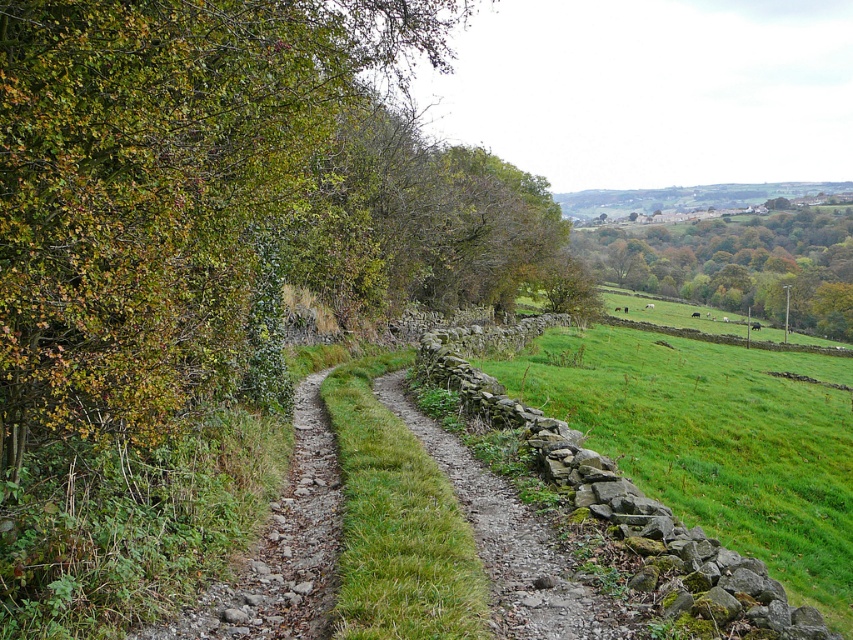
Is green grassy field at right in front of dull gray gravel path at left?

No.

How distant is green grassy field at right from dull gray gravel path at left?

They are 77.24 feet apart.

Does point (848, 502) come in front of point (268, 566)?

No, (848, 502) is behind (268, 566).

Find the location of a particular element. Image resolution: width=853 pixels, height=640 pixels. green grassy field at right is located at coordinates (714, 440).

Which is above, green leafy tree at upper left or green leafy tree at upper right?

green leafy tree at upper right is above.

Identify the location of green leafy tree at upper left. This screenshot has width=853, height=640. (418, 221).

This screenshot has width=853, height=640. What are the coordinates of `green leafy tree at upper left` in the screenshot? It's located at (418, 221).

From the picture: Does green leafy tree at upper right appear on the left side of dull gray gravel path at left?

Incorrect, green leafy tree at upper right is not on the left side of dull gray gravel path at left.

Between green leafy tree at upper right and dull gray gravel path at left, which one appears on the right side from the viewer's perspective?

green leafy tree at upper right is more to the right.

Identify the location of green leafy tree at upper right. (738, 262).